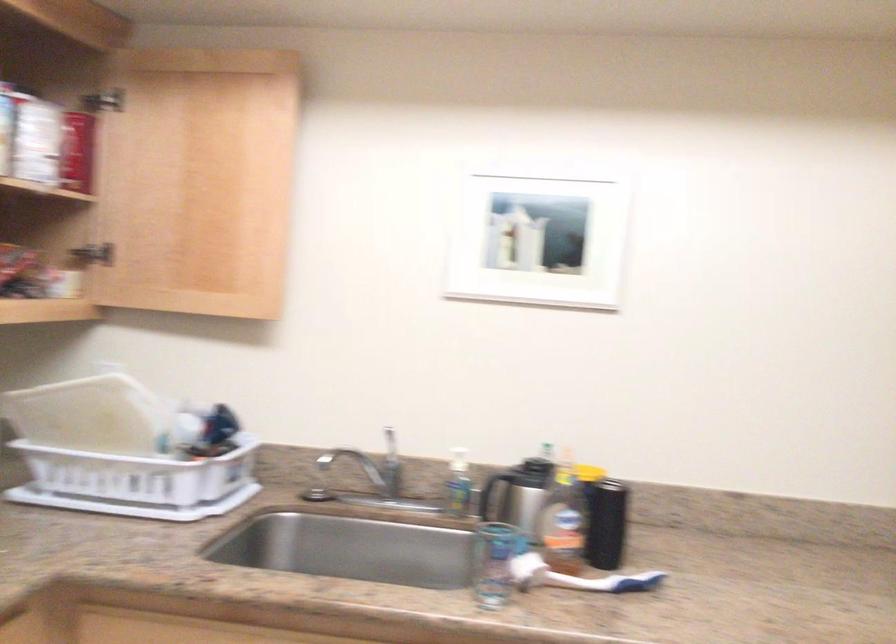
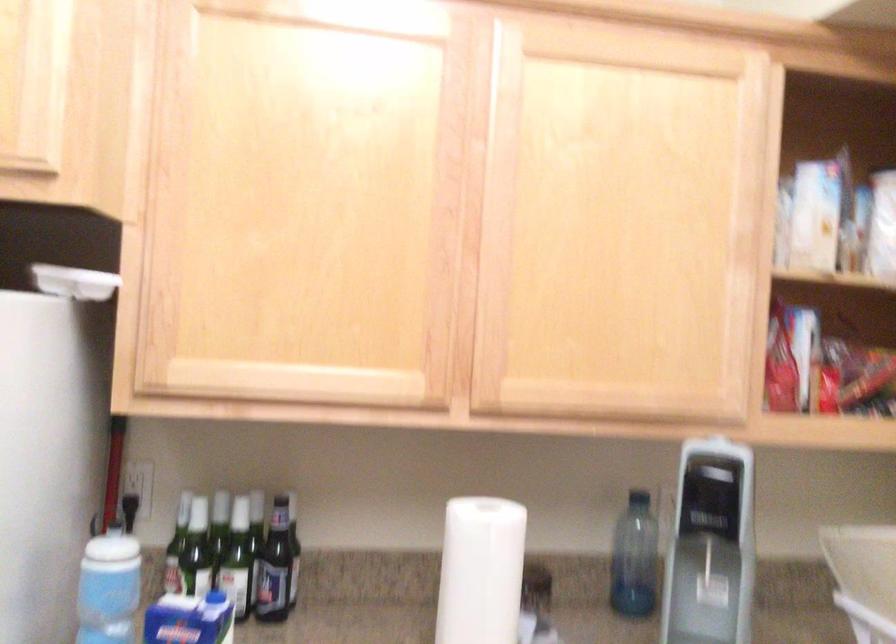
Question: The camera is either moving clockwise (left) or counter-clockwise (right) around the object. The first image is from the beginning of the video and the second image is from the end. Is the camera moving left or right when shooting the video?

Choices:
 (A) Left
 (B) Right

Answer: (B)